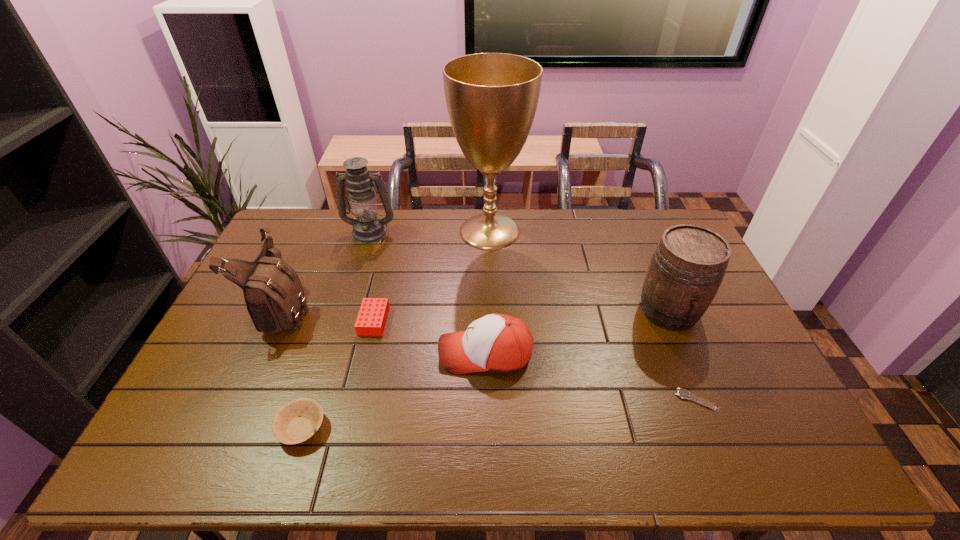
Locate an element on the screen. This screenshot has width=960, height=540. free region at the near right corner of the desktop is located at coordinates (748, 457).

Identify the location of empty space between the oil lamp and the watch. (534, 316).

At what (x,y) coordinates should I click in order to perform the action: click on free area in between the tallest object and the oil lamp. Please return your answer as a coordinate pair (x, y). This screenshot has height=540, width=960. Looking at the image, I should click on (430, 231).

This screenshot has width=960, height=540. What are the coordinates of `free space between the oil lamp and the tallest object` in the screenshot? It's located at (430, 231).

You are a GUI agent. You are given a task and a screenshot of the screen. Output one action in this format:
    pyautogui.click(x=<x>, y=<y>)
    Task: Click on the free space between the trophy cup and the baseball cap
    
    Given the screenshot: What is the action you would take?
    pyautogui.click(x=488, y=292)

This screenshot has width=960, height=540. Identify the location of empty space between the cider and the tallest object. (579, 271).

You are a GUI agent. You are given a task and a screenshot of the screen. Output one action in this format:
    pyautogui.click(x=<x>, y=<y>)
    Task: Click on the vacant region between the leftmost object and the third shortest object
    This screenshot has height=540, width=960.
    Given the screenshot: What is the action you would take?
    pyautogui.click(x=329, y=315)

You are a GUI agent. You are given a task and a screenshot of the screen. Output one action in this format:
    pyautogui.click(x=<x>, y=<y>)
    Task: Click on the empty location between the tallest object and the Lego
    The height and width of the screenshot is (540, 960).
    Given the screenshot: What is the action you would take?
    pyautogui.click(x=432, y=276)

Where is `blank region between the sixth tallest object and the cider`? The image size is (960, 540). blank region between the sixth tallest object and the cider is located at coordinates (521, 316).

Where is `vacant space that is in between the Lego and the fourth shortest object`? Image resolution: width=960 pixels, height=540 pixels. vacant space that is in between the Lego and the fourth shortest object is located at coordinates (430, 337).